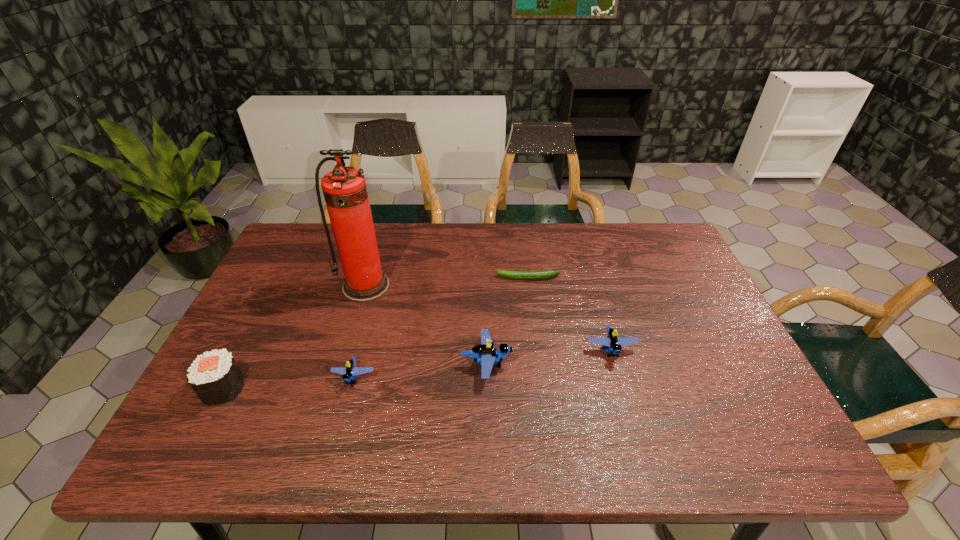
The width and height of the screenshot is (960, 540). Identify the location of free space at the left edge of the desktop. (273, 299).

Find the location of `vacant area at the right edge of the desktop`. vacant area at the right edge of the desktop is located at coordinates (666, 290).

Locate an element on the screen. The height and width of the screenshot is (540, 960). vacant region at the far left corner is located at coordinates (319, 230).

This screenshot has height=540, width=960. I want to click on free space at the far right corner, so click(x=671, y=256).

I want to click on free space that is in between the rightmost object and the tallest object, so click(x=489, y=318).

Where is `free space between the sushi and the fire extinguisher`? free space between the sushi and the fire extinguisher is located at coordinates (295, 337).

Locate an element on the screen. The height and width of the screenshot is (540, 960). vacant area that lies between the second Lego from right to left and the tallest object is located at coordinates (426, 325).

This screenshot has height=540, width=960. What are the coordinates of `vacant region between the sushi and the third shortest object` in the screenshot? It's located at (417, 369).

At what (x,y) coordinates should I click in order to perform the action: click on free spot between the tallest object and the third shortest object. Please return your answer as a coordinate pair (x, y). This screenshot has width=960, height=540. Looking at the image, I should click on (489, 318).

Where is `vacant area that lies between the fire extinguisher and the zucchini`? This screenshot has width=960, height=540. vacant area that lies between the fire extinguisher and the zucchini is located at coordinates (446, 282).